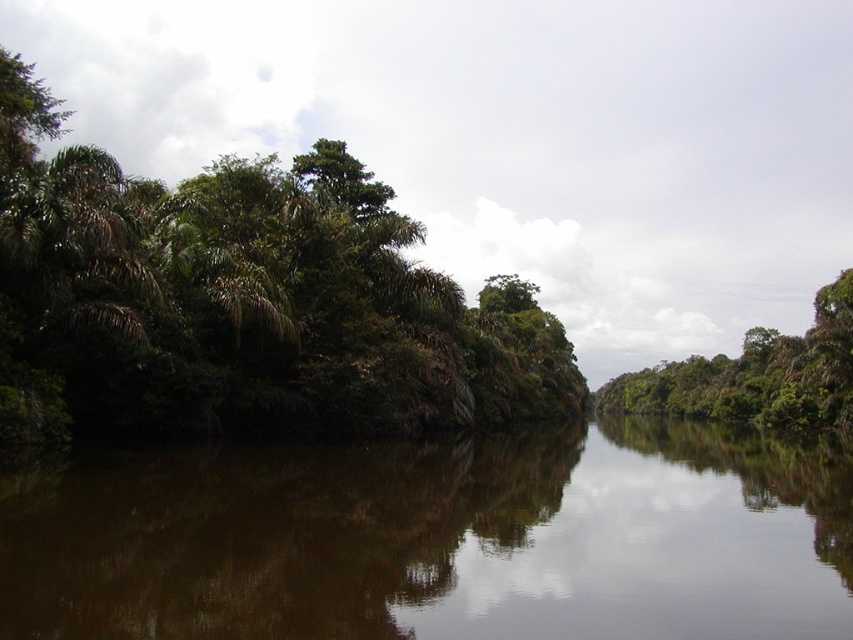
Does brown reflective water at center have a lesser width compared to green leafy tree at center?

Yes.

Is brown reflective water at center further to camera compared to green leafy tree at center?

No, brown reflective water at center is in front of green leafy tree at center.

Between point (454, 580) and point (817, 337), which one is positioned in front?

Point (454, 580) is more forward.

Where is `brown reflective water at center`? This screenshot has width=853, height=640. brown reflective water at center is located at coordinates (440, 540).

Can you confirm if brown reflective water at center is smaller than green leafy trees at left?

Correct, brown reflective water at center occupies less space than green leafy trees at left.

Between brown reflective water at center and green leafy trees at left, which one appears on the right side from the viewer's perspective?

From the viewer's perspective, brown reflective water at center appears more on the right side.

Where is `brown reflective water at center`? Image resolution: width=853 pixels, height=640 pixels. brown reflective water at center is located at coordinates (440, 540).

Is point (164, 234) behind point (752, 396)?

No, it is in front of (752, 396).

Does green leafy trees at left have a greater height compared to green leafy tree at center?

Indeed, green leafy trees at left has a greater height compared to green leafy tree at center.

Between point (135, 262) and point (730, 400), which one is positioned behind?

Positioned behind is point (730, 400).

This screenshot has width=853, height=640. In order to click on green leafy trees at left in this screenshot , I will do `click(242, 300)`.